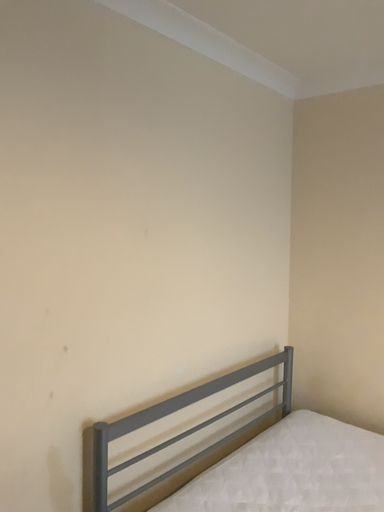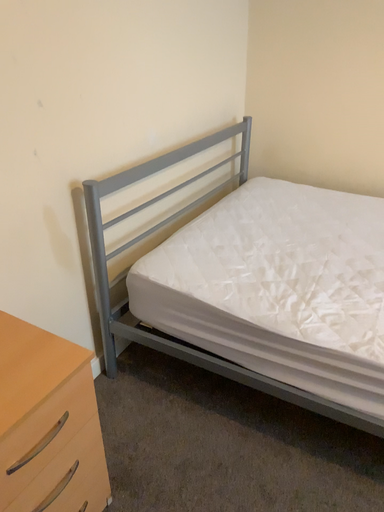
Question: Which way did the camera rotate in the video?

Choices:
 (A) rotated downward
 (B) rotated upward

Answer: (A)